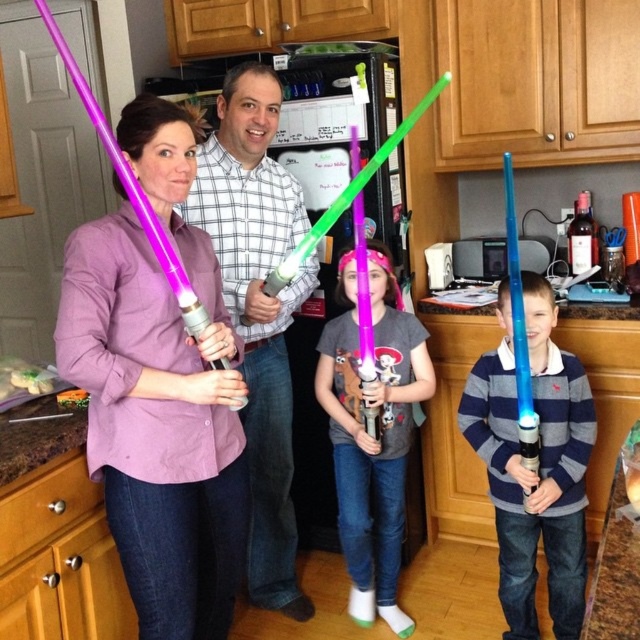
Between matte green plastic lightsaber at center and blue translucent light saber at center, which one has less height?

blue translucent light saber at center is shorter.

How much distance is there between matte green plastic lightsaber at center and blue translucent light saber at center?

A distance of 34.00 inches exists between matte green plastic lightsaber at center and blue translucent light saber at center.

The image size is (640, 640). What are the coordinates of `matte green plastic lightsaber at center` in the screenshot? It's located at (257, 308).

Between point (102, 278) and point (582, 433), which one is positioned in front?

Positioned in front is point (102, 278).

Who is positioned more to the right, matte pink shirt at center or blue translucent light saber at center?

blue translucent light saber at center

Between point (246, 518) and point (529, 573), which one is positioned behind?

Point (529, 573)

Where is `matte pink shirt at center`? The height and width of the screenshot is (640, 640). matte pink shirt at center is located at coordinates (157, 392).

Between matte pink shirt at center and matte purple lightsaber at center, which one is positioned higher?

matte pink shirt at center

Is matte pink shirt at center wider than matte purple lightsaber at center?

No, matte pink shirt at center is not wider than matte purple lightsaber at center.

Locate an element on the screen. This screenshot has width=640, height=640. matte pink shirt at center is located at coordinates (157, 392).